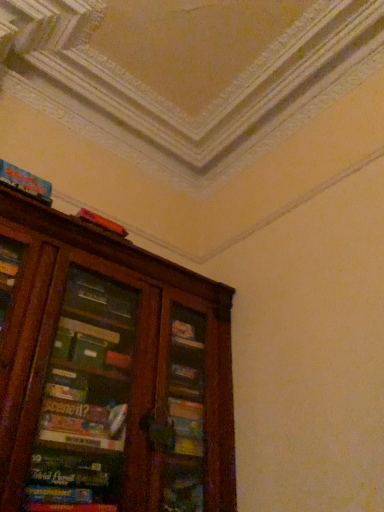
The image size is (384, 512). I want to click on matte cardboard book at upper left, so click(25, 182).

This screenshot has height=512, width=384. What do you see at coordinates (25, 182) in the screenshot?
I see `matte cardboard book at upper left` at bounding box center [25, 182].

This screenshot has height=512, width=384. Identify the location of matte cardboard book at upper left. [25, 182].